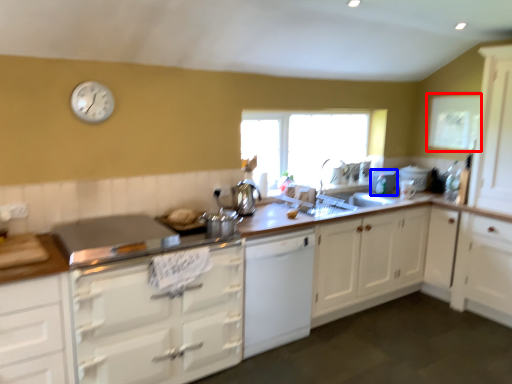
Question: Which object appears farthest to the camera in this image, window screen (highlighted by a red box) or appliance (highlighted by a blue box)?

Choices:
 (A) window screen
 (B) appliance

Answer: (B)